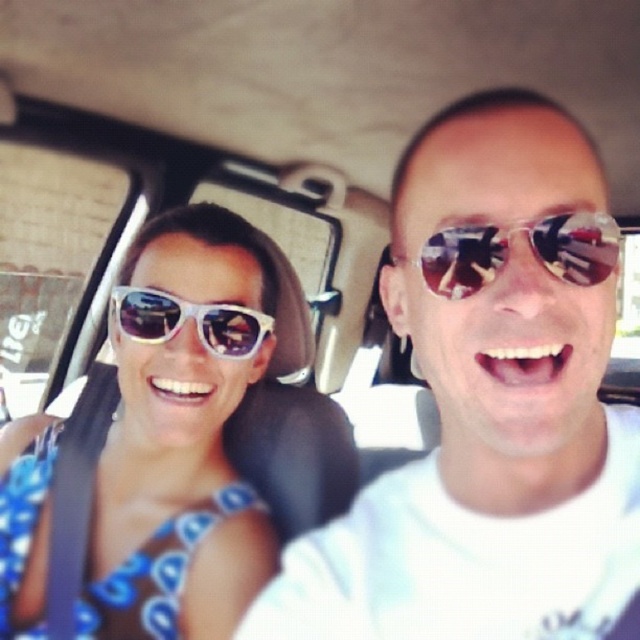
Question: Can you confirm if shiny reflective sunglasses at center is wider than white plastic sunglasses at left?

Choices:
 (A) yes
 (B) no

Answer: (B)

Question: Does shiny silver sunglasses at center appear on the right side of white plastic sunglasses at left?

Choices:
 (A) yes
 (B) no

Answer: (A)

Question: Which object appears farthest from the camera in this image?

Choices:
 (A) shiny silver sunglasses at center
 (B) shiny reflective sunglasses at center
 (C) white plastic sunglasses at left

Answer: (C)

Question: Which object is closer to the camera taking this photo?

Choices:
 (A) shiny reflective sunglasses at center
 (B) shiny silver sunglasses at center
 (C) white plastic sunglasses at left

Answer: (B)

Question: Is shiny silver sunglasses at center further to camera compared to white glossy sunglasses at upper left?

Choices:
 (A) yes
 (B) no

Answer: (B)

Question: Which is farther from the white plastic sunglasses at left?

Choices:
 (A) white glossy sunglasses at upper left
 (B) shiny reflective sunglasses at center

Answer: (B)